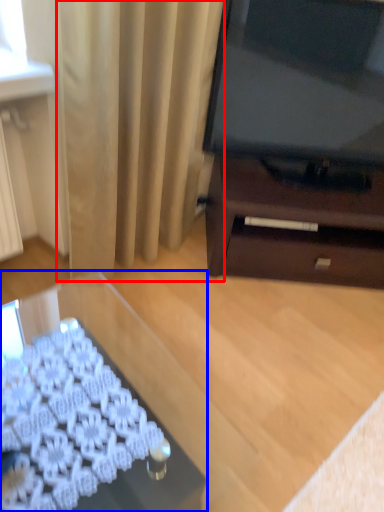
Question: Which point is closer to the camera, curtain (highlighted by a red box) or desk (highlighted by a blue box)?

Choices:
 (A) curtain
 (B) desk

Answer: (B)